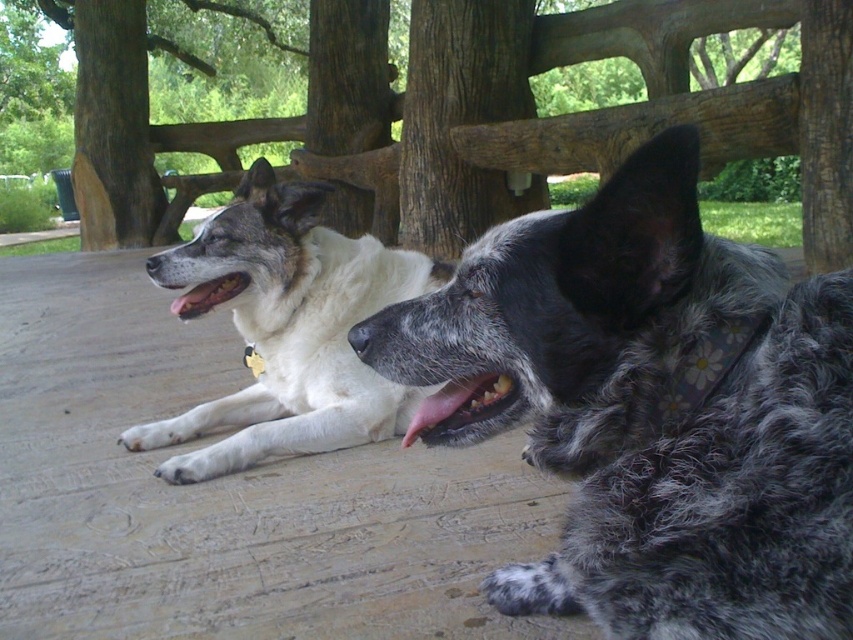
Which is more to the left, spotted fur dog at center or white fur dog at left?

Positioned to the left is white fur dog at left.

Image resolution: width=853 pixels, height=640 pixels. What do you see at coordinates (650, 406) in the screenshot?
I see `spotted fur dog at center` at bounding box center [650, 406].

What are the coordinates of `spotted fur dog at center` in the screenshot? It's located at (650, 406).